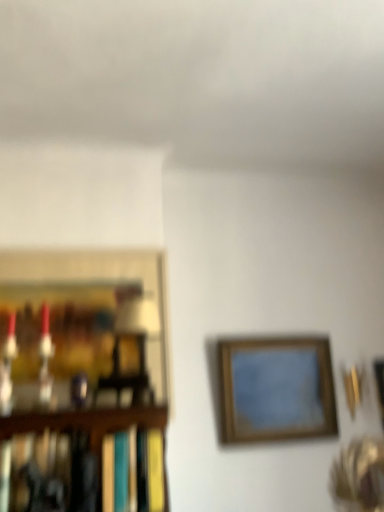
Question: Considering the relative positions of wooden frame at upper right, the first picture frame when ordered from right to left, and wooden framed picture at center, which is the second picture frame from right to left, in the image provided, is wooden frame at upper right, the first picture frame when ordered from right to left, to the right of wooden framed picture at center, which is the second picture frame from right to left, from the viewer's perspective?

Choices:
 (A) yes
 (B) no

Answer: (A)

Question: Is wooden frame at upper right, the first picture frame when ordered from right to left, oriented towards wooden framed picture at center, which appears as the 2th picture frame when viewed from the left?

Choices:
 (A) yes
 (B) no

Answer: (B)

Question: Is wooden frame at upper right, the third picture frame viewed from the left, next to wooden framed picture at center, which is the second picture frame from right to left, and touching it?

Choices:
 (A) no
 (B) yes

Answer: (A)

Question: Can we say wooden frame at upper right, the third picture frame viewed from the left, lies outside wooden framed picture at center, which is the second picture frame from right to left?

Choices:
 (A) yes
 (B) no

Answer: (A)

Question: Does wooden frame at upper right, the third picture frame viewed from the left, have a lesser height compared to wooden framed picture at center, which appears as the 2th picture frame when viewed from the left?

Choices:
 (A) yes
 (B) no

Answer: (A)

Question: Looking at their shapes, would you say wooden frame at upper right, the first picture frame when ordered from right to left, is wider or thinner than hardcover book at left?

Choices:
 (A) thin
 (B) wide

Answer: (A)

Question: From the image's perspective, is wooden frame at upper right, the third picture frame viewed from the left, located above or below hardcover book at left?

Choices:
 (A) below
 (B) above

Answer: (A)

Question: Looking at the image, does wooden frame at upper right, the third picture frame viewed from the left, seem bigger or smaller compared to hardcover book at left?

Choices:
 (A) big
 (B) small

Answer: (B)

Question: Is wooden frame at upper right, the third picture frame viewed from the left, situated inside hardcover book at left or outside?

Choices:
 (A) outside
 (B) inside

Answer: (A)

Question: Is wooden picture frame at left, which is counted as the 3th picture frame, starting from the right, in front of or behind wooden frame at upper right, the third picture frame viewed from the left, in the image?

Choices:
 (A) behind
 (B) front

Answer: (B)

Question: Which is correct: wooden picture frame at left, which ranks as the 1th picture frame in left-to-right order, is inside wooden frame at upper right, the third picture frame viewed from the left, or outside of it?

Choices:
 (A) outside
 (B) inside

Answer: (A)

Question: Looking at their shapes, would you say wooden picture frame at left, which is counted as the 3th picture frame, starting from the right, is wider or thinner than wooden frame at upper right, the first picture frame when ordered from right to left?

Choices:
 (A) thin
 (B) wide

Answer: (B)

Question: From a real-world perspective, is wooden picture frame at left, which ranks as the 1th picture frame in left-to-right order, positioned above or below wooden frame at upper right, the first picture frame when ordered from right to left?

Choices:
 (A) above
 (B) below

Answer: (A)

Question: Is wooden frame at upper right, the first picture frame when ordered from right to left, bigger or smaller than wooden picture frame at left, which ranks as the 1th picture frame in left-to-right order?

Choices:
 (A) small
 (B) big

Answer: (A)

Question: Is wooden frame at upper right, the third picture frame viewed from the left, wider or thinner than wooden picture frame at left, which ranks as the 1th picture frame in left-to-right order?

Choices:
 (A) wide
 (B) thin

Answer: (B)